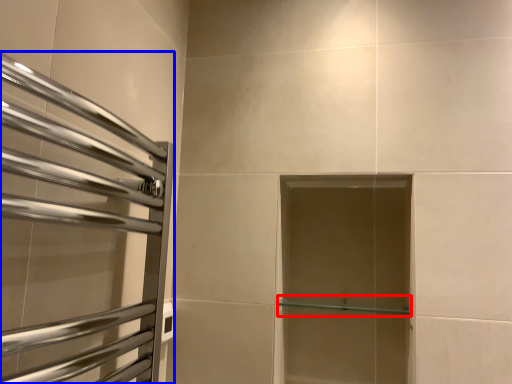
Question: Which of the following is the closest to the observer, shelf (highlighted by a red box) or screen door (highlighted by a blue box)?

Choices:
 (A) shelf
 (B) screen door

Answer: (B)